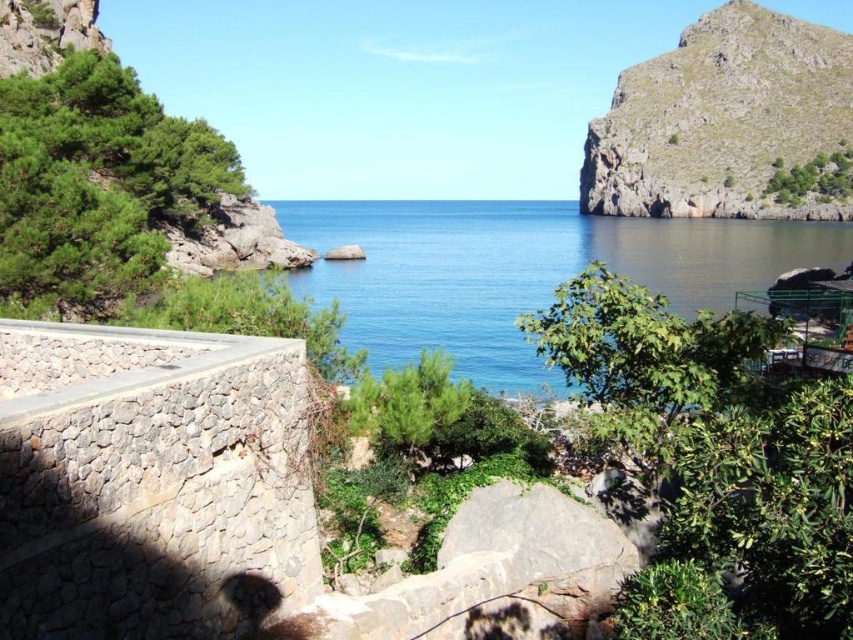
You are standing at the stone wall in the foreground of the coastal landscape. You notice a specific point marked at coordinates (521, 272). Based on the scene description, what does this point indicate?

The point at coordinates (521, 272) marks the location of blue water at center in the coastal landscape.

You are standing on the stone wall in the foreground and want to reach the smooth gray rock at center. Which direction should you move to avoid the rugged rock cliff at upper right blocking your path?

To avoid the rugged rock cliff at upper right blocking your path, move towards the left side of the stone wall. The rugged rock cliff at upper right is positioned over the smooth gray rock at center, so moving left would bypass it.